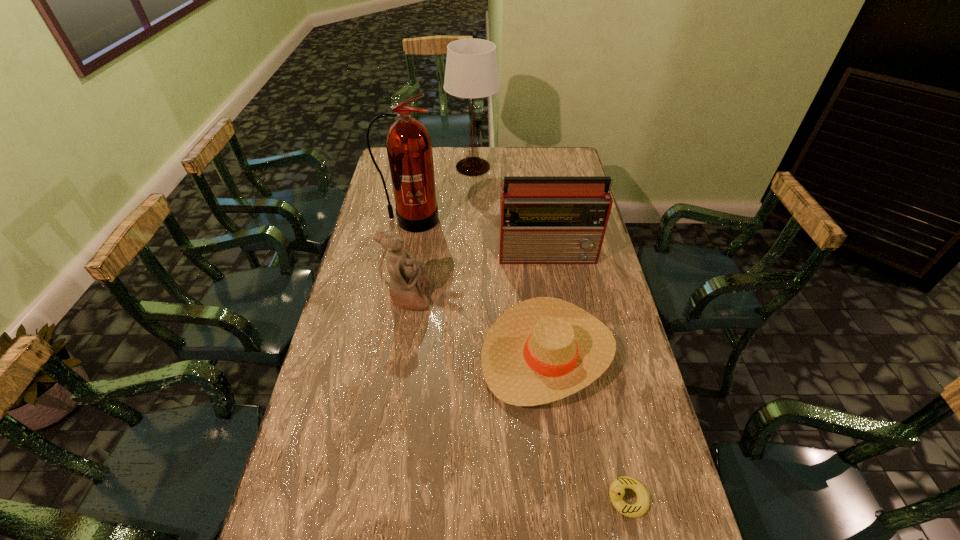
Locate which object ranks second in proximity to the third farthest object. Please provide its 2D coordinates. Your answer should be formatted as a tuple, i.e. [(x, y)], where the tuple contains the x and y coordinates of a point satisfying the conditions above.

[(409, 147)]